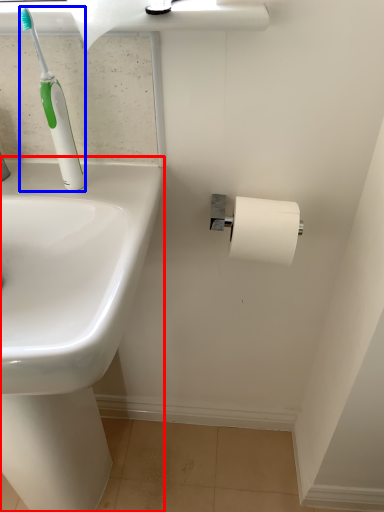
Question: Among these objects, which one is farthest to the camera, sink (highlighted by a red box) or toilet brush (highlighted by a blue box)?

Choices:
 (A) sink
 (B) toilet brush

Answer: (B)